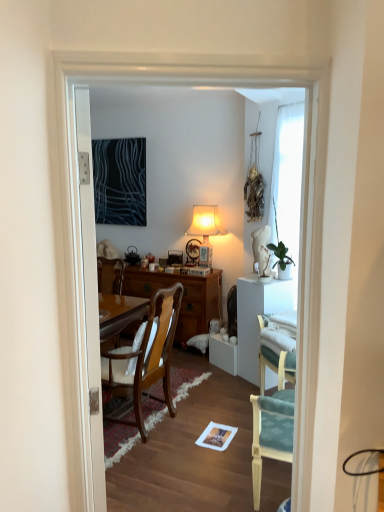
Question: Is white glossy door at left not within teal fabric chair at right, placed as the 2th chair when sorted from left to right?

Choices:
 (A) yes
 (B) no

Answer: (A)

Question: Is white glossy door at left positioned far away from teal fabric chair at right, placed as the 2th chair when sorted from left to right?

Choices:
 (A) yes
 (B) no

Answer: (B)

Question: Is white glossy door at left in contact with teal fabric chair at right, placed as the 1th chair when sorted from front to back?

Choices:
 (A) yes
 (B) no

Answer: (B)

Question: Can you confirm if white glossy door at left is positioned to the right of teal fabric chair at right, the second chair positioned from the back?

Choices:
 (A) yes
 (B) no

Answer: (B)

Question: Can you confirm if white glossy door at left is thinner than teal fabric chair at right, placed as the 1th chair when sorted from front to back?

Choices:
 (A) no
 (B) yes

Answer: (B)

Question: Can you confirm if white glossy door at left is smaller than teal fabric chair at right, the second chair positioned from the back?

Choices:
 (A) no
 (B) yes

Answer: (A)

Question: Is green glossy houseplant at upper right bigger than white glossy door at left?

Choices:
 (A) yes
 (B) no

Answer: (B)

Question: Can you confirm if green glossy houseplant at upper right is positioned to the left of white glossy door at left?

Choices:
 (A) yes
 (B) no

Answer: (B)

Question: Is the depth of green glossy houseplant at upper right less than that of white glossy door at left?

Choices:
 (A) no
 (B) yes

Answer: (A)

Question: Considering the relative positions of green glossy houseplant at upper right and white glossy door at left in the image provided, is green glossy houseplant at upper right behind white glossy door at left?

Choices:
 (A) no
 (B) yes

Answer: (B)

Question: Is green glossy houseplant at upper right not within white glossy door at left?

Choices:
 (A) yes
 (B) no

Answer: (A)

Question: Can you confirm if green glossy houseplant at upper right is shorter than white glossy door at left?

Choices:
 (A) no
 (B) yes

Answer: (B)

Question: Does white glossy door at left have a lesser height compared to dark blue fabric at upper left?

Choices:
 (A) yes
 (B) no

Answer: (B)